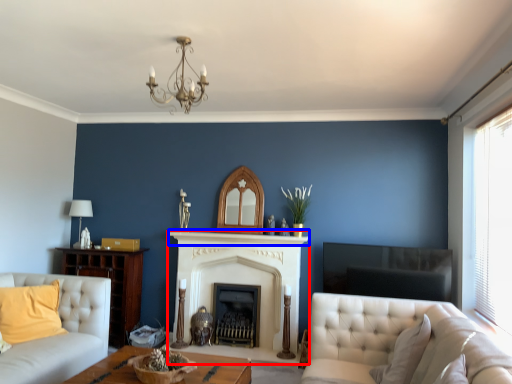
Question: Which point is further to the camera, fireplace (highlighted by a red box) or mantle (highlighted by a blue box)?

Choices:
 (A) fireplace
 (B) mantle

Answer: (A)